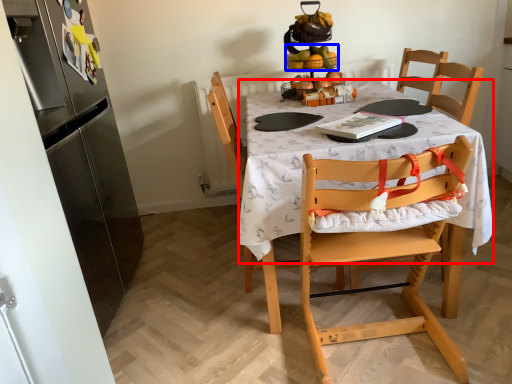
Question: Which object appears closest to the camera in this image, round table (highlighted by a red box) or fruit (highlighted by a blue box)?

Choices:
 (A) round table
 (B) fruit

Answer: (A)